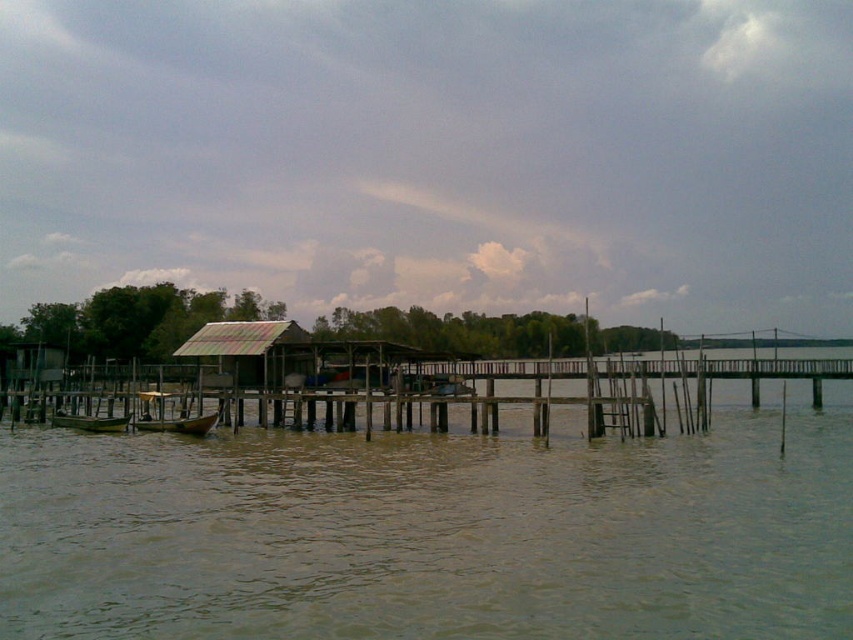
What do you see at coordinates (239, 339) in the screenshot? The width and height of the screenshot is (853, 640). I see `rusty corrugated metal hut at center` at bounding box center [239, 339].

Consider the image. Who is more distant from viewer, (229, 353) or (97, 429)?

The point (229, 353) is more distant.

Where is `rusty corrugated metal hut at center`? This screenshot has height=640, width=853. rusty corrugated metal hut at center is located at coordinates (239, 339).

Between brown murky water at lower center and rusty corrugated metal hut at center, which one appears on the right side from the viewer's perspective?

Positioned to the right is brown murky water at lower center.

Can you confirm if brown murky water at lower center is bigger than rusty corrugated metal hut at center?

Incorrect, brown murky water at lower center is not larger than rusty corrugated metal hut at center.

Is point (279, 627) in front of point (252, 355)?

Yes.

Where is `brown murky water at lower center`? brown murky water at lower center is located at coordinates (431, 534).

Is rusty corrugated metal hut at center shorter than wooden boat at center?

In fact, rusty corrugated metal hut at center may be taller than wooden boat at center.

Is point (219, 348) in front of point (192, 426)?

That is False.

Where is `rusty corrugated metal hut at center`? This screenshot has height=640, width=853. rusty corrugated metal hut at center is located at coordinates pyautogui.click(x=239, y=339).